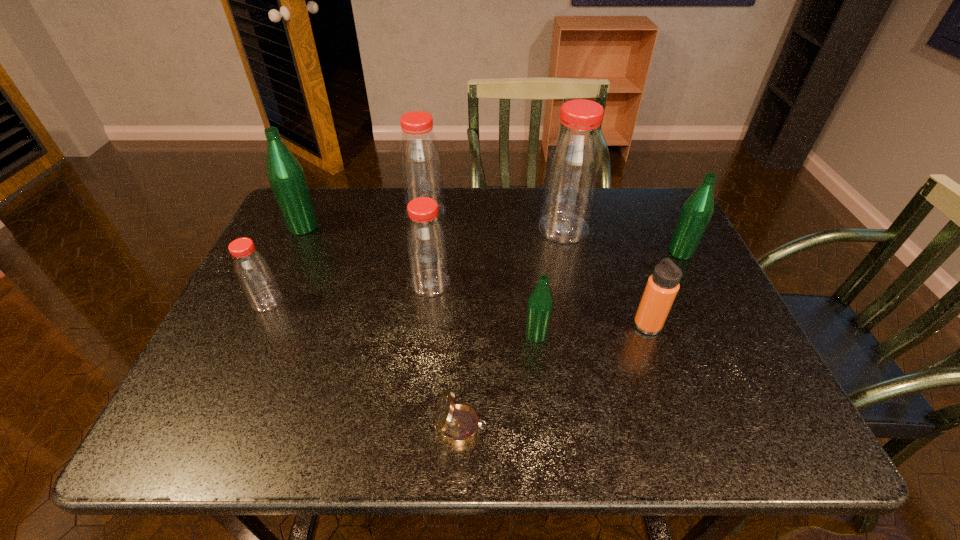
Identify the location of vacant space located on the right of the second object from right to left. This screenshot has height=540, width=960. pos(705,325).

The width and height of the screenshot is (960, 540). I want to click on vacant space located on the front of the smallest red bottle, so click(x=253, y=329).

This screenshot has height=540, width=960. Find the location of `vacant area situated on the back of the smallest green bottle`. vacant area situated on the back of the smallest green bottle is located at coordinates (524, 227).

Image resolution: width=960 pixels, height=540 pixels. Identify the location of vacant space located 0.100m with the dial facing the compass. (539, 427).

Where is `object at the near edge`? This screenshot has width=960, height=540. object at the near edge is located at coordinates (458, 424).

The image size is (960, 540). I want to click on object located in the right edge section of the desktop, so click(697, 210).

Where is `object located at the far left corner`? This screenshot has height=540, width=960. object located at the far left corner is located at coordinates (286, 176).

What are the coordinates of `blank space at the far edge of the desktop` in the screenshot? It's located at (514, 187).

You are a GUI agent. You are given a task and a screenshot of the screen. Output one action in this format:
    pyautogui.click(x=<x>, y=<y>)
    Task: Click on the vacant area at the near edge of the desktop
    This screenshot has height=540, width=960.
    Given the screenshot: What is the action you would take?
    pyautogui.click(x=407, y=408)

In the image, there is a desktop. Where is `free space at the left edge`? This screenshot has width=960, height=540. free space at the left edge is located at coordinates (303, 242).